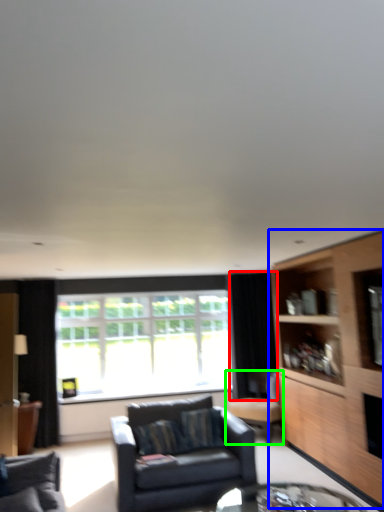
Question: Considering the real-world distances, which object is farthest from curtain (highlighted by a red box)? cabinetry (highlighted by a blue box) or chair (highlighted by a green box)?

Choices:
 (A) cabinetry
 (B) chair

Answer: (A)